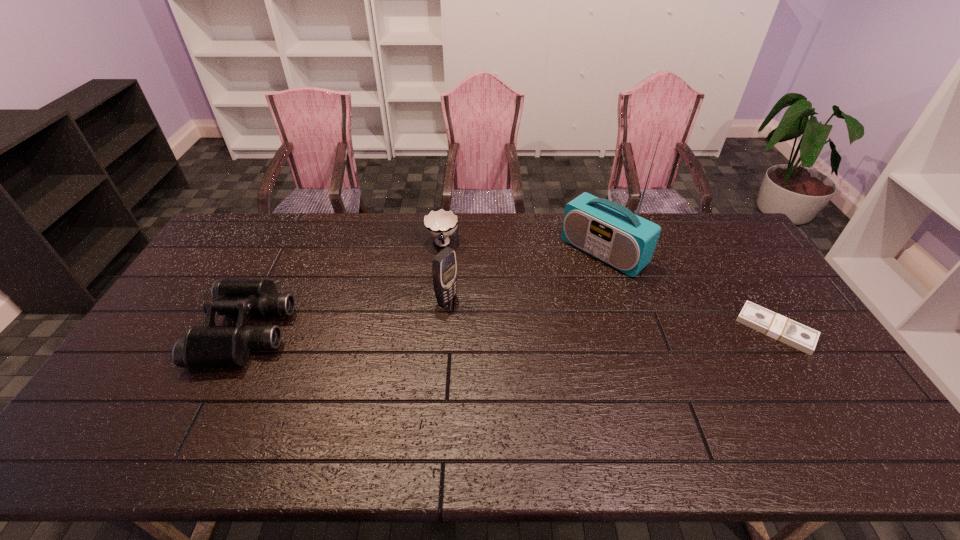
This screenshot has height=540, width=960. Identify the location of free area in between the cup and the radio receiver. (522, 248).

Where is `unoccupied position between the rightmost object and the second object from right to left`? The height and width of the screenshot is (540, 960). unoccupied position between the rightmost object and the second object from right to left is located at coordinates (689, 291).

In order to click on vacant area that lies between the cup and the binoculars in this screenshot , I will do `click(345, 287)`.

The height and width of the screenshot is (540, 960). Find the location of `free spot between the tallest object and the cup`. free spot between the tallest object and the cup is located at coordinates (522, 248).

Choose which object is the third nearest neighbor to the cellular telephone. Please provide its 2D coordinates. Your answer should be formatted as a tuple, i.e. [(x, y)], where the tuple contains the x and y coordinates of a point satisfying the conditions above.

[(207, 346)]

Identify the location of object identified as the closest to the shortest object. The image size is (960, 540). (612, 233).

Where is `vacant space that satisfies the following two spatial constraints: 1. on the front side of the rightmost object; 2. on the left side of the cellular telephone`? Image resolution: width=960 pixels, height=540 pixels. vacant space that satisfies the following two spatial constraints: 1. on the front side of the rightmost object; 2. on the left side of the cellular telephone is located at coordinates (444, 329).

Where is `vacant space that satisfies the following two spatial constraints: 1. on the front side of the second tallest object; 2. on the left side of the dollar`? This screenshot has width=960, height=540. vacant space that satisfies the following two spatial constraints: 1. on the front side of the second tallest object; 2. on the left side of the dollar is located at coordinates tap(444, 329).

Where is `free space that satisfies the following two spatial constraints: 1. on the front side of the fourth tallest object; 2. on the left side of the dollar`? The image size is (960, 540). free space that satisfies the following two spatial constraints: 1. on the front side of the fourth tallest object; 2. on the left side of the dollar is located at coordinates (434, 329).